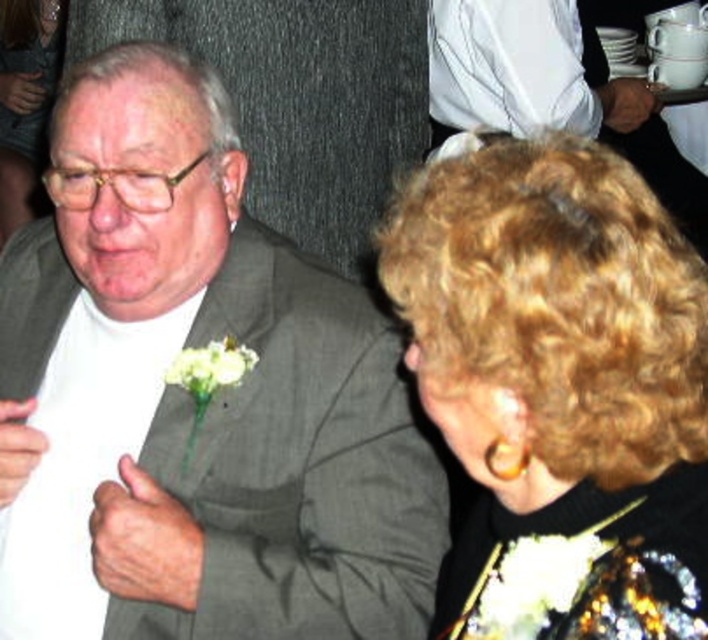
Question: Which point is farther to the camera?

Choices:
 (A) (354, 305)
 (B) (210, 364)
 (C) (406, 305)
 (D) (11, 216)

Answer: (D)

Question: Can you confirm if shiny gold necklace at upper center is positioned to the left of white matte flower at center?

Choices:
 (A) yes
 (B) no

Answer: (A)

Question: Does curly hair at upper right lie in front of white matte flower at center?

Choices:
 (A) yes
 (B) no

Answer: (A)

Question: Is shiny gold necklace at upper center to the left of white matte flower at center from the viewer's perspective?

Choices:
 (A) no
 (B) yes

Answer: (B)

Question: Considering the real-world distances, which object is closest to the matte gray suit at center?

Choices:
 (A) curly hair at upper right
 (B) white matte flower at center

Answer: (B)

Question: Which object appears farthest from the camera in this image?

Choices:
 (A) matte gray suit at center
 (B) shiny gold necklace at upper center
 (C) white matte flower at center

Answer: (B)